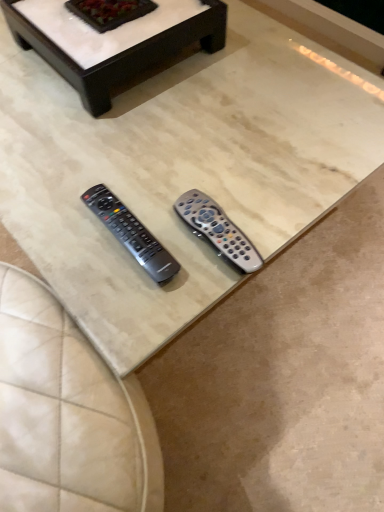
In order to click on vacant position to the left of translucent gray remote at center, positioned as the 2th remote control in left-to-right order in this screenshot , I will do `click(119, 244)`.